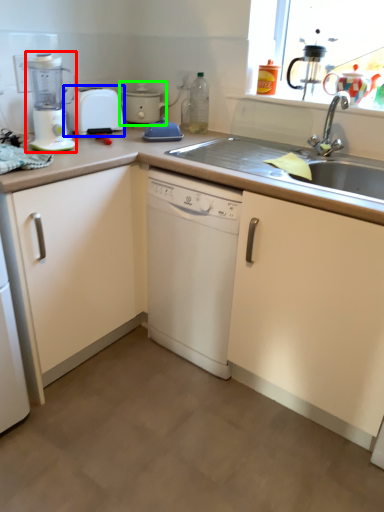
Question: Considering the real-world distances, which object is farthest from kitchen appliance (highlighted by a red box)? toaster (highlighted by a blue box) or cooker (highlighted by a green box)?

Choices:
 (A) toaster
 (B) cooker

Answer: (B)